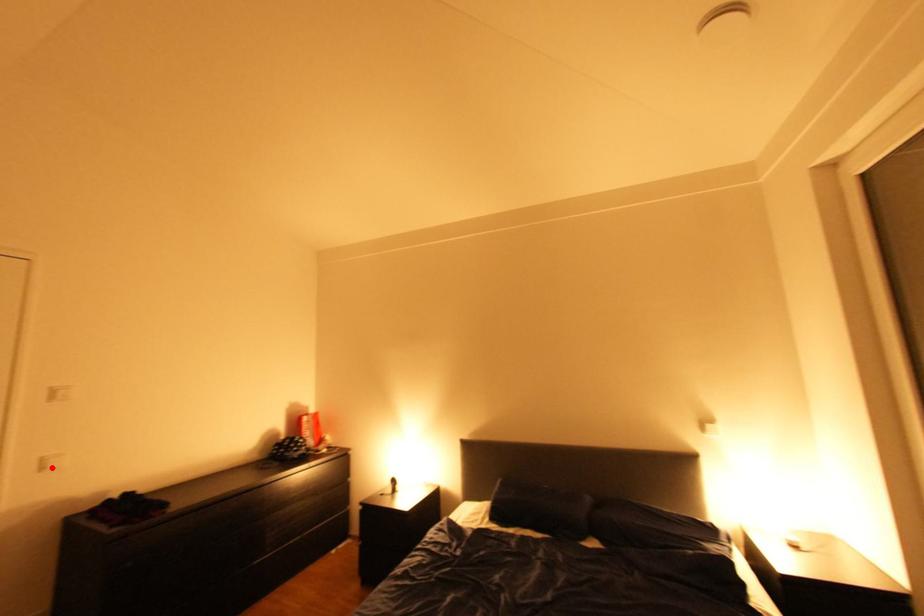
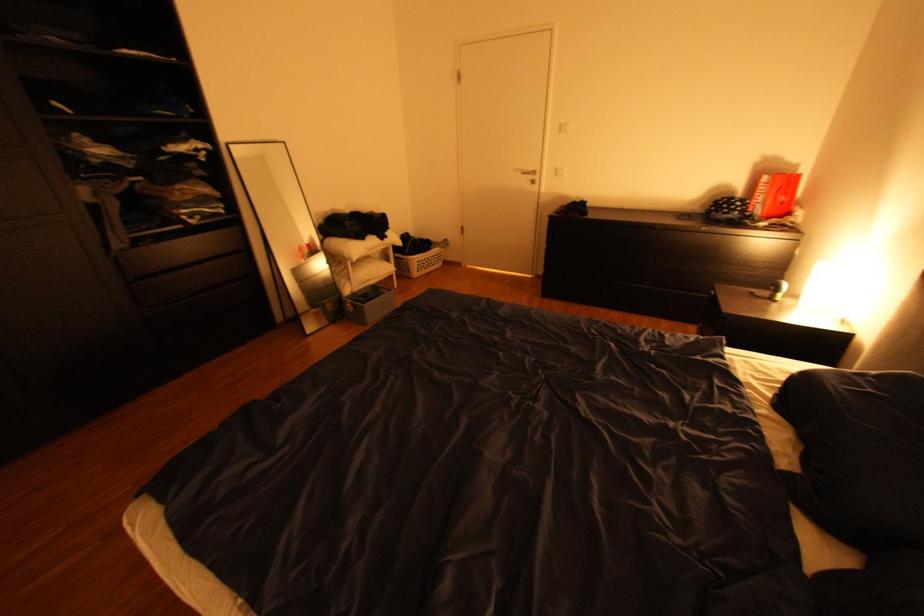
Find the pixel in the second image that matches the highlighted location in the first image.

(565, 174)